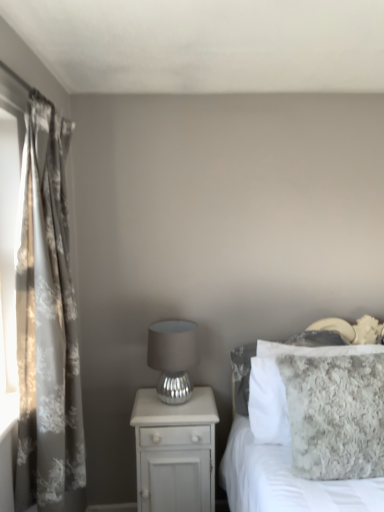
Locate an element on the screen. empty space that is ontop of white glossy nightstand at lower left (from a real-world perspective) is located at coordinates (169, 400).